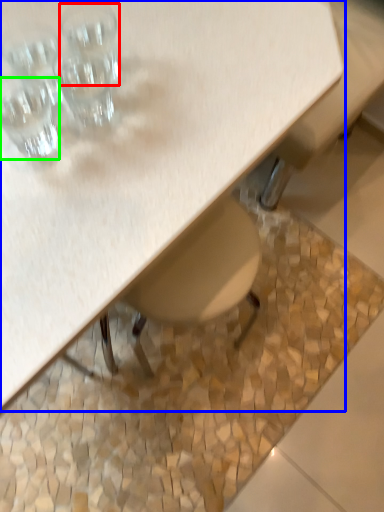
Question: Which object is the closest to the shot glass (highlighted by a red box)? Choose among these: table (highlighted by a blue box) or shot glass (highlighted by a green box).

Choices:
 (A) table
 (B) shot glass

Answer: (B)